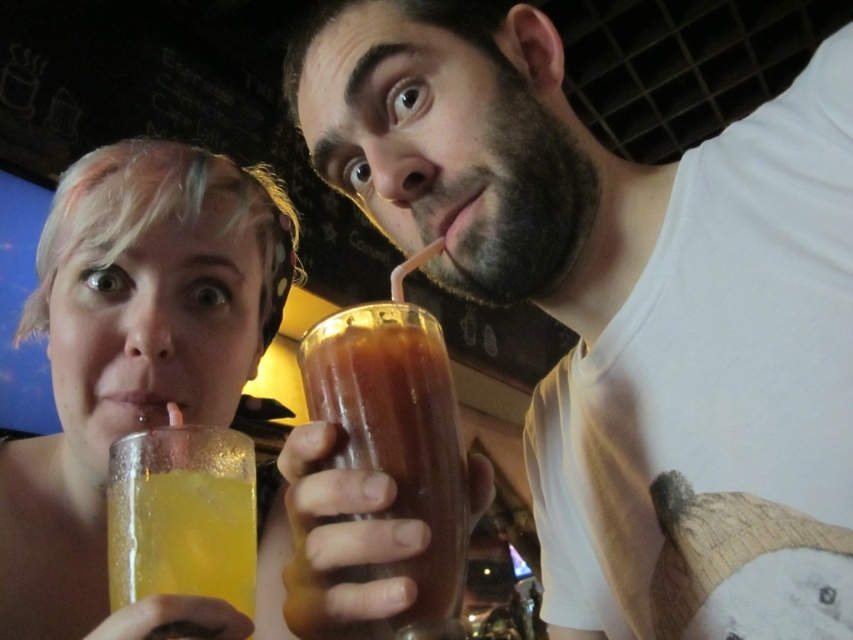
Question: In this image, where is translucent glass beverage at center located relative to translucent yellow liquid at lower left?

Choices:
 (A) left
 (B) right

Answer: (B)

Question: Does translucent glass beverage at center appear under translucent yellow liquid at lower left?

Choices:
 (A) no
 (B) yes

Answer: (A)

Question: Which point appears farthest from the camera in this image?

Choices:
 (A) (206, 150)
 (B) (148, 563)

Answer: (A)

Question: Which object is closer to the camera taking this photo?

Choices:
 (A) translucent glass beverage at center
 (B) matte plastic cup at upper center
 (C) translucent yellow liquid at lower left
 (D) translucent glass at upper left

Answer: (D)

Question: Does matte plastic cup at upper center lie in front of translucent glass at upper left?

Choices:
 (A) yes
 (B) no

Answer: (B)

Question: Which object appears farthest from the camera in this image?

Choices:
 (A) translucent glass at upper left
 (B) translucent glass beverage at center

Answer: (B)